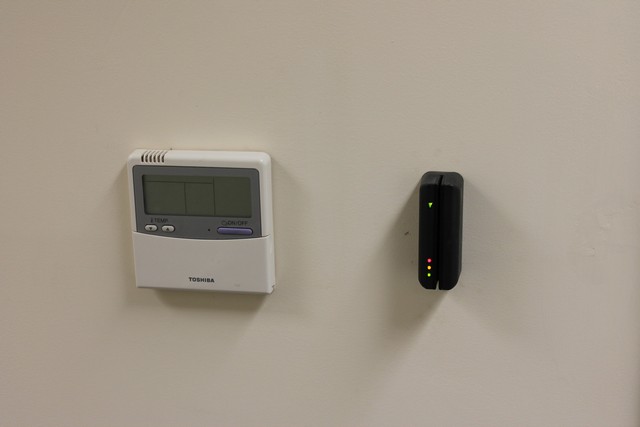
At what (x,y) coordinates should I click in order to perform the action: click on thermostat. Please return your answer as a coordinate pair (x, y). Image resolution: width=640 pixels, height=427 pixels. Looking at the image, I should click on (203, 270).